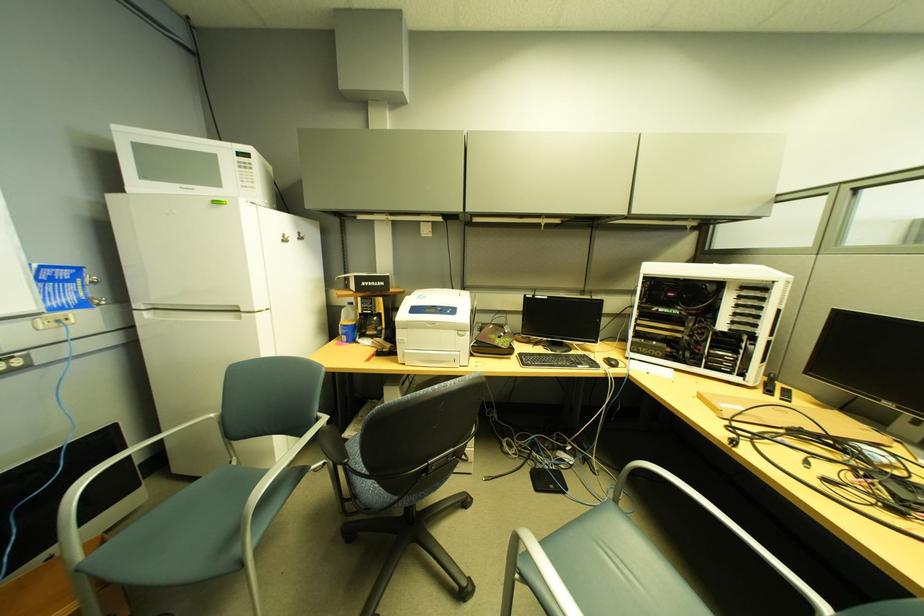
The image size is (924, 616). What do you see at coordinates (93, 291) in the screenshot? I see `the coffee carafe handle` at bounding box center [93, 291].